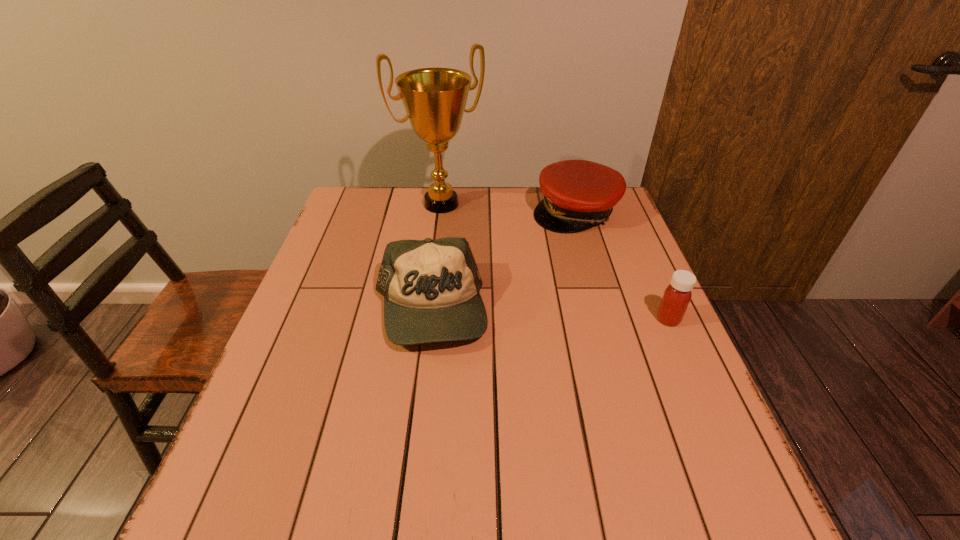
Where is `baseball cap`? baseball cap is located at coordinates (431, 288).

The width and height of the screenshot is (960, 540). In order to click on medicine in this screenshot , I will do `click(676, 298)`.

Where is `cap`? This screenshot has height=540, width=960. cap is located at coordinates (578, 194).

The image size is (960, 540). I want to click on award, so 434,99.

I want to click on vacant space located on the front-facing side of the baseball cap, so click(418, 407).

The height and width of the screenshot is (540, 960). Identify the location of free region located 0.170m on the left of the medicine. (584, 319).

Identify the location of free spot located 0.060m at the front of the cap where the visor is located. The height and width of the screenshot is (540, 960). (577, 248).

You are a GUI agent. You are given a task and a screenshot of the screen. Output one action in this format:
    pyautogui.click(x=<x>, y=<y>)
    Task: Click on the free space located 0.210m at the front of the cap where the visor is located
    
    Given the screenshot: What is the action you would take?
    pyautogui.click(x=578, y=283)

The height and width of the screenshot is (540, 960). I want to click on free space located at the front of the cap where the visor is located, so click(577, 266).

Where is `free space located on the front view with handles of the award`? The height and width of the screenshot is (540, 960). free space located on the front view with handles of the award is located at coordinates (486, 265).